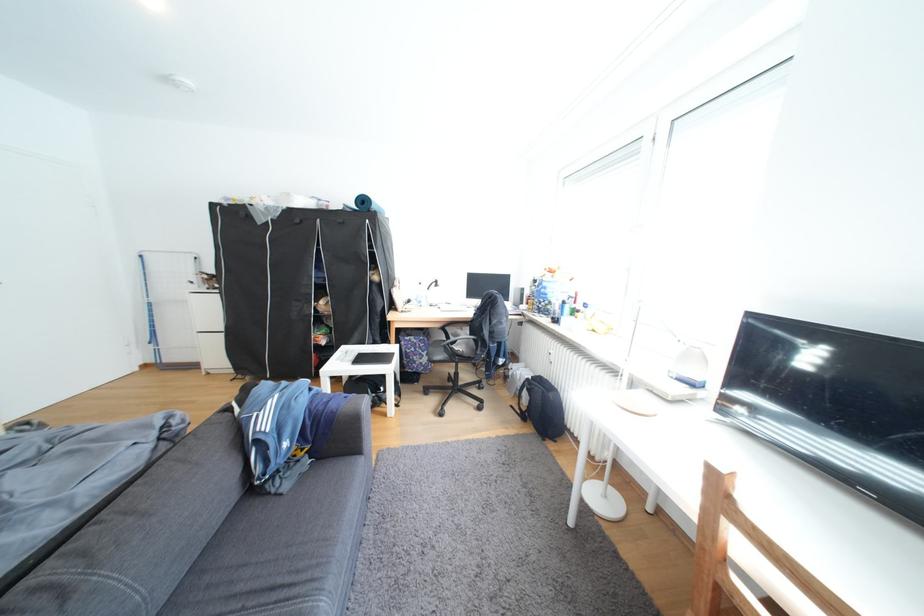
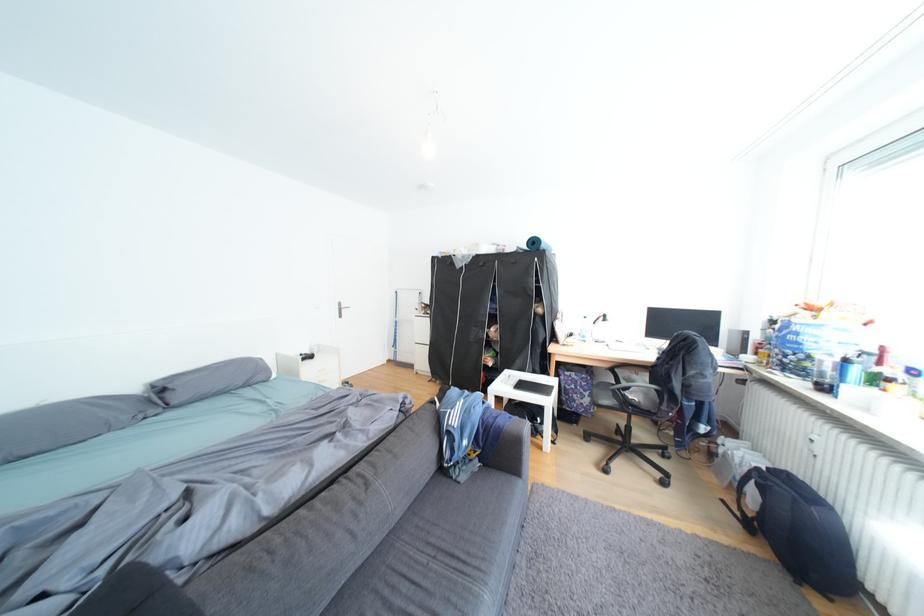
In the second image, find the point that corresponds to point 391,321 in the first image.

(552, 352)